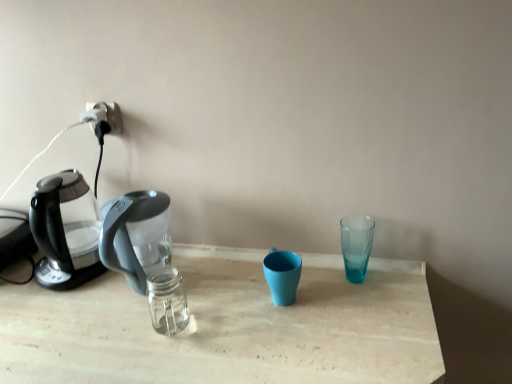
Question: Should I look upward or downward to see matte blue cup at center, the 2th coffee cup when ordered from right to left?

Choices:
 (A) down
 (B) up

Answer: (A)

Question: Is matte blue cup at center, which is counted as the 1th coffee cup, starting from the left, not inside transparent glass at right, the first coffee cup in the right-to-left sequence?

Choices:
 (A) no
 (B) yes

Answer: (B)

Question: Is transparent glass at right, which is counted as the 2th coffee cup, starting from the left, inside matte blue cup at center, the 2th coffee cup when ordered from right to left?

Choices:
 (A) no
 (B) yes

Answer: (A)

Question: From a real-world perspective, is matte blue cup at center, which is counted as the 1th coffee cup, starting from the left, on top of transparent glass at right, which is counted as the 2th coffee cup, starting from the left?

Choices:
 (A) yes
 (B) no

Answer: (B)

Question: Is matte blue cup at center, which is counted as the 1th coffee cup, starting from the left, at the left side of transparent glass at right, which is counted as the 2th coffee cup, starting from the left?

Choices:
 (A) yes
 (B) no

Answer: (A)

Question: Can you confirm if matte blue cup at center, which is counted as the 1th coffee cup, starting from the left, is bigger than transparent glass at right, which is counted as the 2th coffee cup, starting from the left?

Choices:
 (A) yes
 (B) no

Answer: (A)

Question: From the image's perspective, is matte blue cup at center, the 2th coffee cup when ordered from right to left, located above transparent glass at right, the first coffee cup in the right-to-left sequence?

Choices:
 (A) yes
 (B) no

Answer: (B)

Question: Is transparent plastic kettle at left thinner than white plastic plug at upper left?

Choices:
 (A) yes
 (B) no

Answer: (B)

Question: Is transparent plastic kettle at left shorter than white plastic plug at upper left?

Choices:
 (A) no
 (B) yes

Answer: (A)

Question: Does transparent plastic kettle at left come behind white plastic plug at upper left?

Choices:
 (A) yes
 (B) no

Answer: (B)

Question: Are transparent plastic kettle at left and white plastic plug at upper left far apart?

Choices:
 (A) yes
 (B) no

Answer: (B)

Question: Is transparent plastic kettle at left to the left of white plastic plug at upper left from the viewer's perspective?

Choices:
 (A) no
 (B) yes

Answer: (B)

Question: Is transparent plastic kettle at left to the right of white plastic plug at upper left from the viewer's perspective?

Choices:
 (A) no
 (B) yes

Answer: (A)

Question: Can you confirm if matte blue cup at center, the 2th coffee cup when ordered from right to left, is shorter than transparent plastic kettle at left?

Choices:
 (A) yes
 (B) no

Answer: (A)